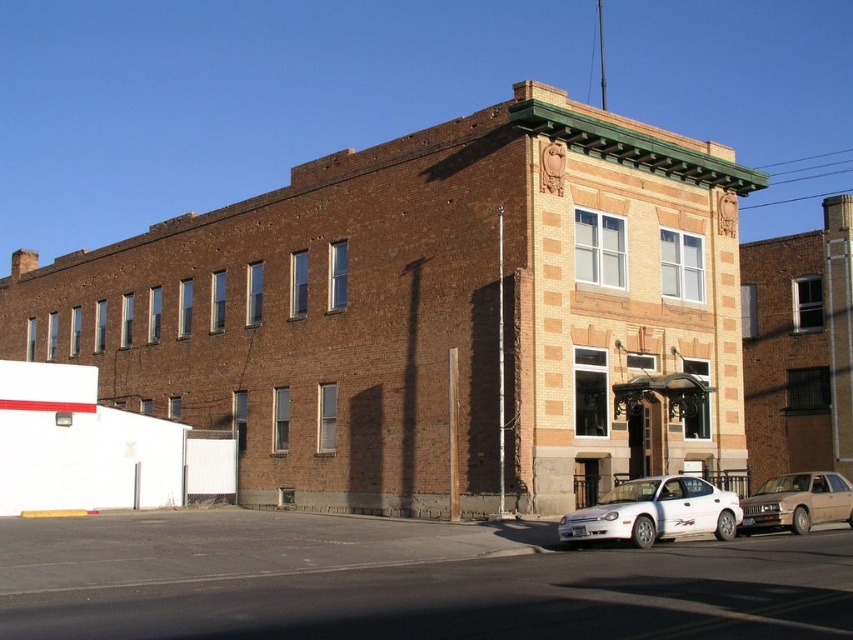
Is point (703, 506) farther from camera compared to point (820, 515)?

No.

Does white matte sedan at lower right lie behind gold metallic sedan at lower right?

No, it is not.

At what (x,y) coordinates should I click in order to perform the action: click on white matte sedan at lower right. Please return your answer as a coordinate pair (x, y). Image resolution: width=853 pixels, height=640 pixels. Looking at the image, I should click on (654, 513).

Locate an element on the screen. white matte sedan at lower right is located at coordinates (654, 513).